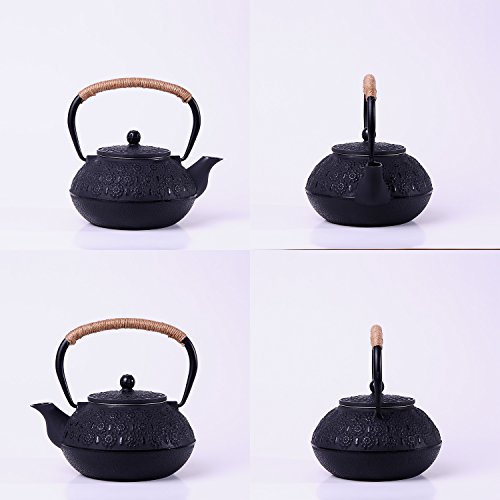
Where is `the bottom shadow of spout on white surface`? the bottom shadow of spout on white surface is located at coordinates (162, 493), (332, 482), (374, 240), (175, 232).